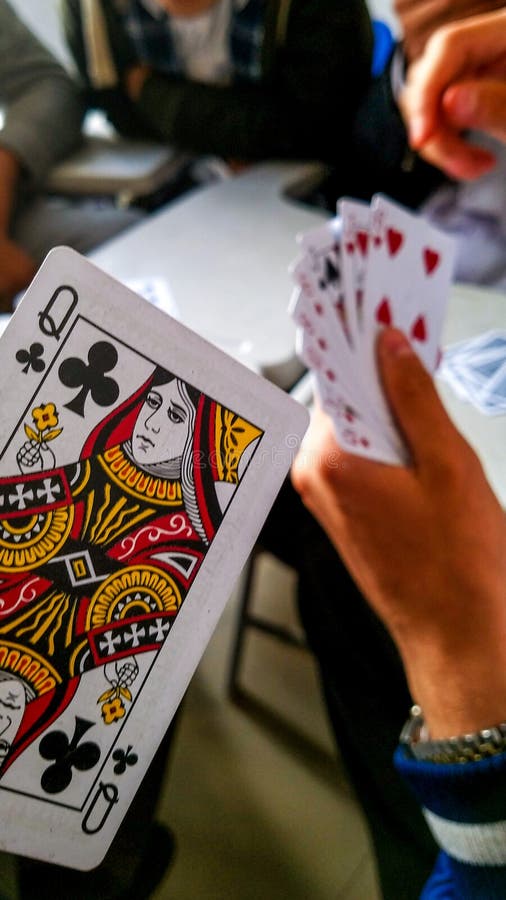
Find the location of a particular element. tables is located at coordinates (472, 299), (236, 259), (121, 166).